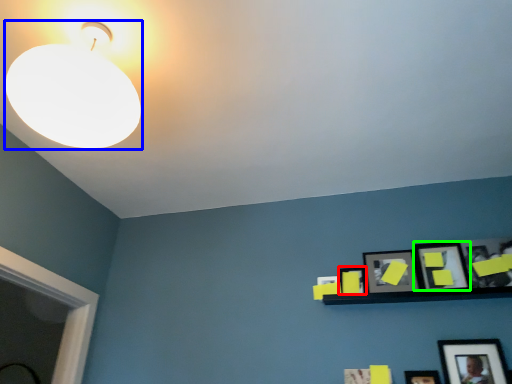
Question: Considering the real-world distances, which object is farthest from picture frame (highlighted by a red box)? lamp (highlighted by a blue box) or picture frame (highlighted by a green box)?

Choices:
 (A) lamp
 (B) picture frame

Answer: (A)